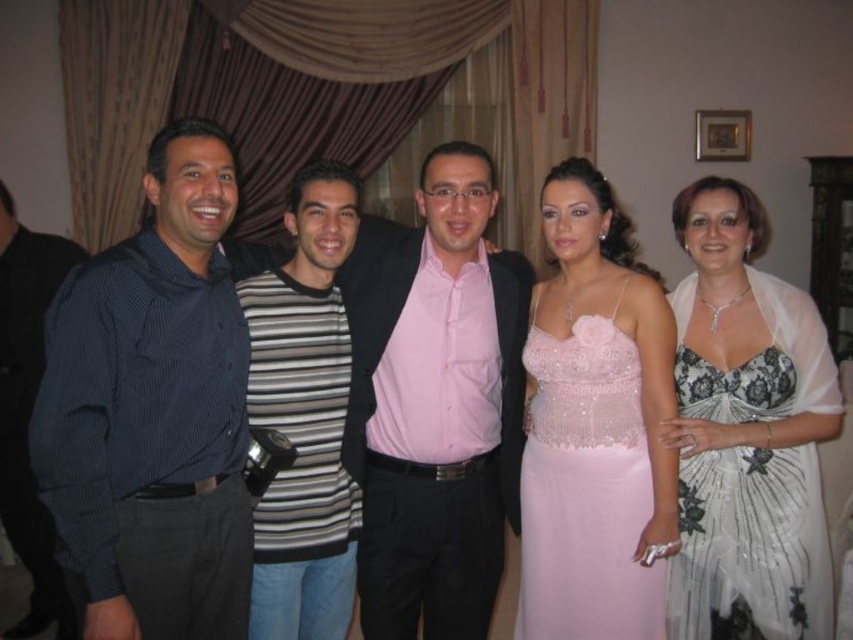
Can you confirm if pink satin dress at center is positioned to the left of dark blue corduroy shirt at left?

In fact, pink satin dress at center is to the right of dark blue corduroy shirt at left.

Is pink satin dress at center bigger than dark blue corduroy shirt at left?

Incorrect, pink satin dress at center is not larger than dark blue corduroy shirt at left.

Who is more forward, (578, 516) or (20, 476)?

Positioned in front is point (578, 516).

At what (x,y) coordinates should I click in order to perform the action: click on pink satin dress at center. Please return your answer as a coordinate pair (x, y). This screenshot has width=853, height=640. Looking at the image, I should click on (585, 483).

Who is positioned more to the right, white lace dress at right or striped cotton shirt at center?

Positioned to the right is white lace dress at right.

Consider the image. Between white lace dress at right and striped cotton shirt at center, which one appears on the left side from the viewer's perspective?

striped cotton shirt at center

You are a GUI agent. You are given a task and a screenshot of the screen. Output one action in this format:
    pyautogui.click(x=<x>, y=<y>)
    Task: Click on the white lace dress at right
    The height and width of the screenshot is (640, 853).
    Given the screenshot: What is the action you would take?
    pyautogui.click(x=747, y=433)

Which is behind, point (358, 348) or point (807, 592)?

Positioned behind is point (358, 348).

Can you confirm if pink satin shirt at center is shorter than white lace dress at right?

Incorrect, pink satin shirt at center's height does not fall short of white lace dress at right's.

Between point (492, 275) and point (728, 609), which one is positioned behind?

The point (492, 275) is more distant.

Where is `pink satin shirt at center`? The image size is (853, 640). pink satin shirt at center is located at coordinates (434, 403).